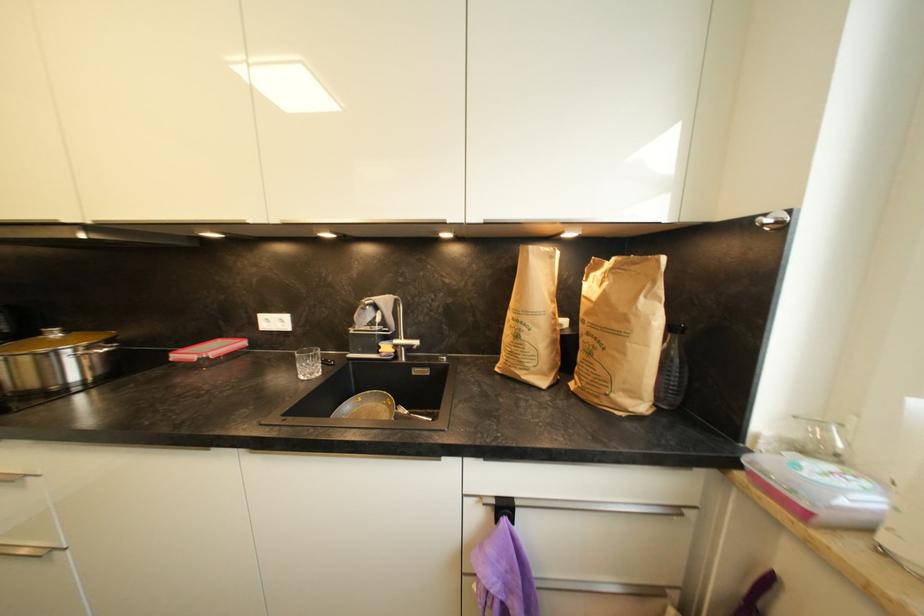
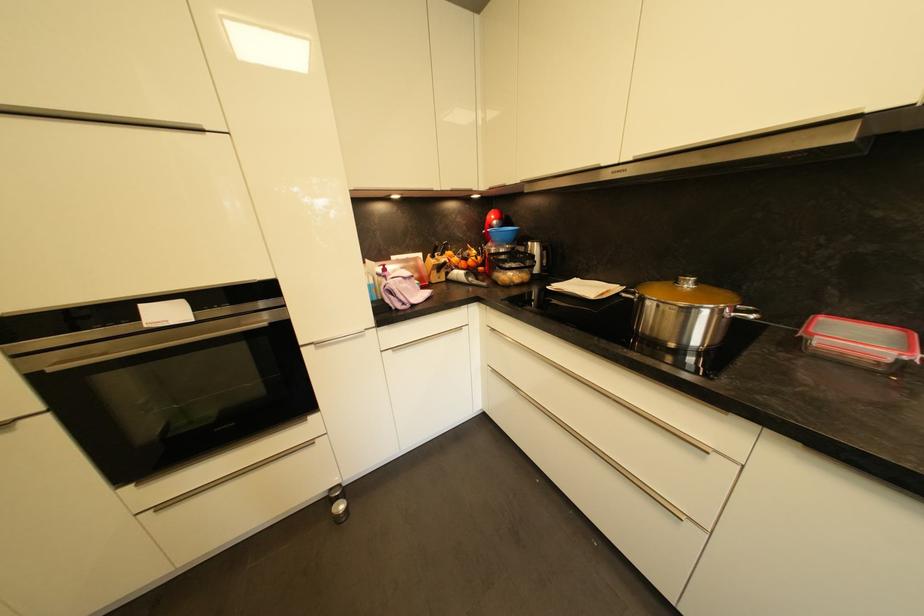
Locate, in the second image, the point that corresponds to [61,337] in the first image.

(694, 286)